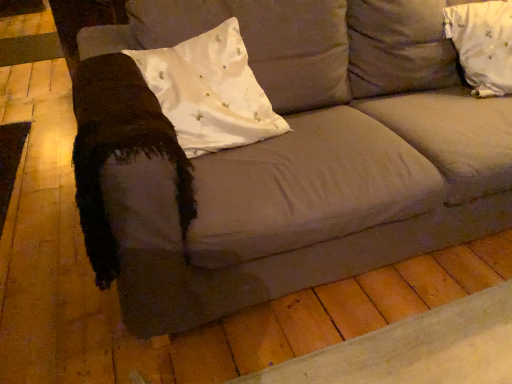
Question: Is white satin pillow at upper right, which appears as the 2th pillow when viewed from the left, shorter than white satin pillow at left, positioned as the 1th pillow in left-to-right order?

Choices:
 (A) no
 (B) yes

Answer: (A)

Question: Is white satin pillow at upper right, acting as the 1th pillow starting from the right, in front of white satin pillow at left, positioned as the 1th pillow in left-to-right order?

Choices:
 (A) yes
 (B) no

Answer: (B)

Question: Would you say white satin pillow at upper right, acting as the 1th pillow starting from the right, is outside white satin pillow at left, positioned as the 1th pillow in left-to-right order?

Choices:
 (A) yes
 (B) no

Answer: (A)

Question: Is white satin pillow at upper right, acting as the 1th pillow starting from the right, smaller than white satin pillow at left, positioned as the 2th pillow in right-to-left order?

Choices:
 (A) yes
 (B) no

Answer: (A)

Question: Is white satin pillow at upper right, which appears as the 2th pillow when viewed from the left, to the right of white satin pillow at left, positioned as the 1th pillow in left-to-right order, from the viewer's perspective?

Choices:
 (A) no
 (B) yes

Answer: (B)

Question: Is white satin pillow at upper right, acting as the 1th pillow starting from the right, further to the viewer compared to white satin pillow at left, positioned as the 1th pillow in left-to-right order?

Choices:
 (A) yes
 (B) no

Answer: (A)

Question: Is white satin pillow at left, positioned as the 1th pillow in left-to-right order, wider than white satin pillow at upper right, acting as the 1th pillow starting from the right?

Choices:
 (A) no
 (B) yes

Answer: (A)

Question: Is white satin pillow at left, positioned as the 1th pillow in left-to-right order, outside white satin pillow at upper right, which appears as the 2th pillow when viewed from the left?

Choices:
 (A) no
 (B) yes

Answer: (B)

Question: Considering the relative positions of white satin pillow at left, positioned as the 2th pillow in right-to-left order, and white satin pillow at upper right, acting as the 1th pillow starting from the right, in the image provided, is white satin pillow at left, positioned as the 2th pillow in right-to-left order, to the right of white satin pillow at upper right, acting as the 1th pillow starting from the right, from the viewer's perspective?

Choices:
 (A) yes
 (B) no

Answer: (B)

Question: Is white satin pillow at upper right, acting as the 1th pillow starting from the right, completely or partially inside white satin pillow at left, positioned as the 1th pillow in left-to-right order?

Choices:
 (A) no
 (B) yes

Answer: (A)

Question: Is white satin pillow at upper right, acting as the 1th pillow starting from the right, at the back of white satin pillow at left, positioned as the 2th pillow in right-to-left order?

Choices:
 (A) no
 (B) yes

Answer: (A)

Question: Considering the relative positions of white satin pillow at left, positioned as the 2th pillow in right-to-left order, and white satin pillow at upper right, which appears as the 2th pillow when viewed from the left, in the image provided, is white satin pillow at left, positioned as the 2th pillow in right-to-left order, to the left of white satin pillow at upper right, which appears as the 2th pillow when viewed from the left, from the viewer's perspective?

Choices:
 (A) yes
 (B) no

Answer: (A)

Question: Based on their sizes in the image, would you say white satin pillow at upper right, acting as the 1th pillow starting from the right, is bigger or smaller than white satin pillow at left, positioned as the 2th pillow in right-to-left order?

Choices:
 (A) big
 (B) small

Answer: (B)